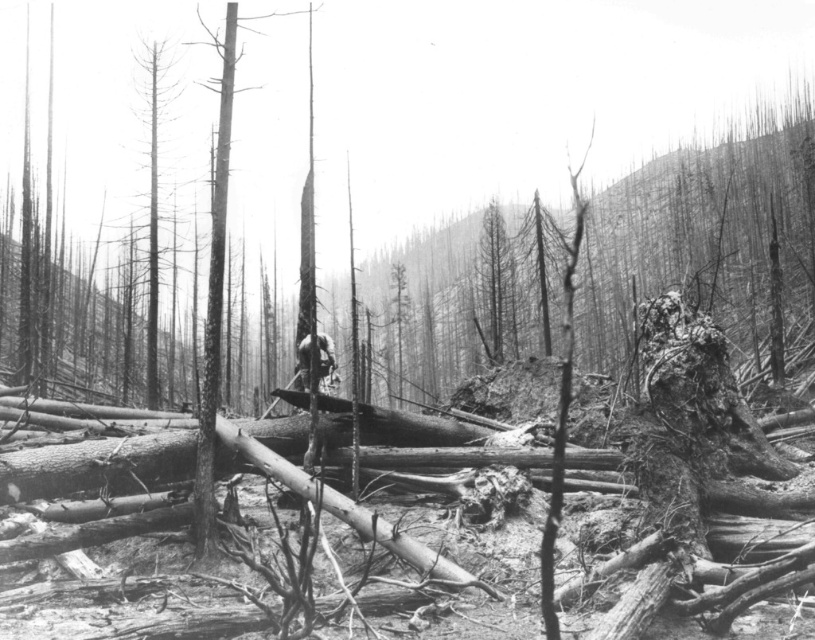
Consider the image. You are a firefighter assessing the damage after a wildfire. You notice a dead wood trunk at left and a dark gray wood at center. Which one is larger in size?

The dead wood trunk at left is bigger than dark gray wood at center.

Based on the coordinates provided in the scene description, where is the charred wood tree at center located?

The charred wood tree at center is located at point (x=494, y=285).